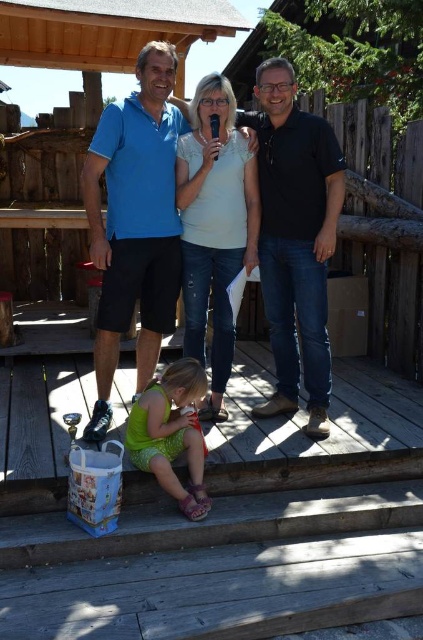
What is located at the coordinates point (134, 221)?

The blue cotton shirt at center is located at point (134, 221).

Consider the image. You are standing on the wooden deck and want to pick up an item. Which of the two points, point (110,145) or point (296,344), is closer to you?

Point (110,145) is closer to the viewer than point (296,344), so you should pick up the item at point (110,145) first as it is nearer.

You are a photographer trying to capture a group photo of the blue cotton shirt at center and the green fabric dress at lower center. To ensure both are in frame, should you pan your camera to the left or right?

The blue cotton shirt at center is to the left of the green fabric dress at lower center, so you should pan your camera to the right to include both in the frame.